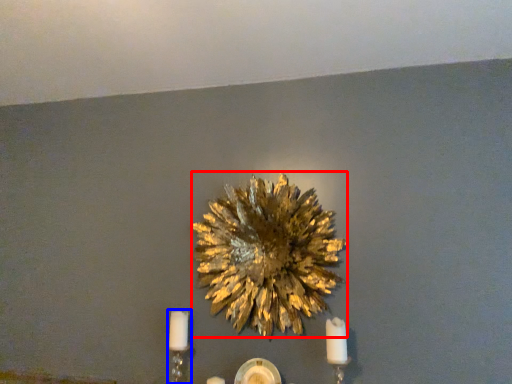
Question: Which point is further to the camera, flower (highlighted by a red box) or candle holder (highlighted by a blue box)?

Choices:
 (A) flower
 (B) candle holder

Answer: (B)